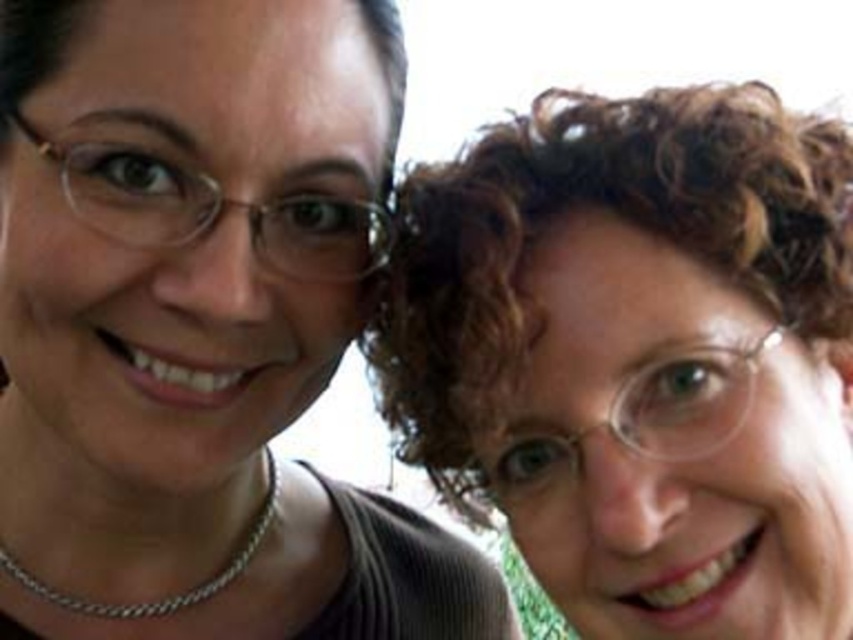
Question: Estimate the real-world distances between objects in this image. Which object is farther from the matte black hair at upper right?

Choices:
 (A) silver chain necklace at left
 (B) curly hair at upper right

Answer: (B)

Question: Which point is farther from the camera taking this photo?

Choices:
 (A) (167, 144)
 (B) (694, 230)

Answer: (A)

Question: From the image, what is the correct spatial relationship of matte black hair at upper right in relation to curly hair at upper right?

Choices:
 (A) below
 (B) above

Answer: (A)

Question: Is the position of curly hair at upper right less distant than that of silver chain necklace at left?

Choices:
 (A) no
 (B) yes

Answer: (B)

Question: Does matte black hair at upper right have a lesser width compared to curly hair at upper right?

Choices:
 (A) yes
 (B) no

Answer: (B)

Question: Which point is farther from the camera taking this photo?

Choices:
 (A) click(519, 429)
 (B) click(36, 563)
 (C) click(33, 582)

Answer: (C)